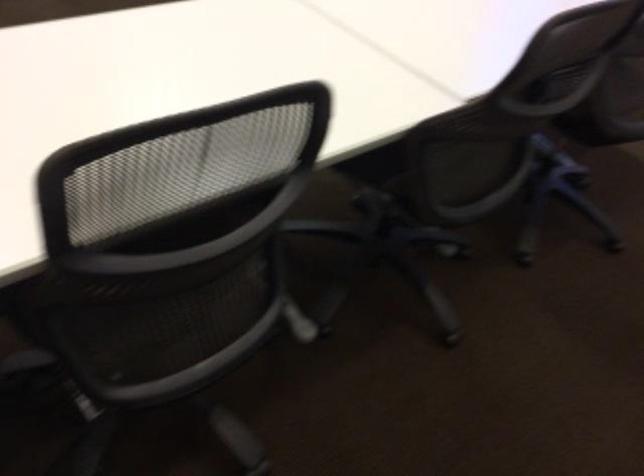
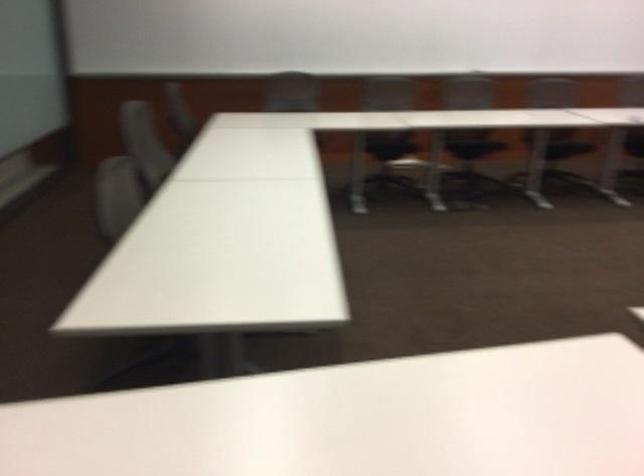
Based on the continuous images, in which direction is the camera rotating?

The camera rotated toward right-down.